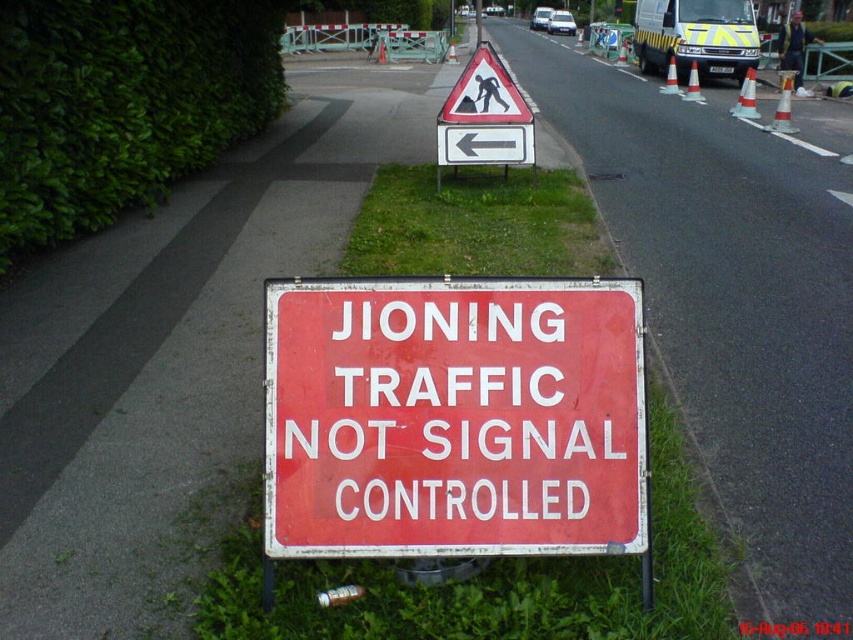
Is red metal sign at center positioned at the back of white plastic sign at upper center?

No.

Between point (525, 288) and point (488, 92), which one is positioned behind?

The point (488, 92) is more distant.

The image size is (853, 640). What do you see at coordinates (453, 417) in the screenshot? I see `red metal sign at center` at bounding box center [453, 417].

Locate an element on the screen. This screenshot has width=853, height=640. red metal sign at center is located at coordinates (453, 417).

Locate an element on the screen. The width and height of the screenshot is (853, 640). red metal sign at center is located at coordinates (453, 417).

This screenshot has width=853, height=640. What are the coordinates of `red metal sign at center` in the screenshot? It's located at (453, 417).

Does green leafy hedge at left have a lesser width compared to white plastic sign at upper center?

Correct, green leafy hedge at left's width is less than white plastic sign at upper center's.

Who is positioned more to the left, green leafy hedge at left or white plastic sign at upper center?

green leafy hedge at left is more to the left.

Between point (128, 170) and point (445, 150), which one is positioned in front?

Point (128, 170) is more forward.

The height and width of the screenshot is (640, 853). I want to click on green leafy hedge at left, so click(122, 104).